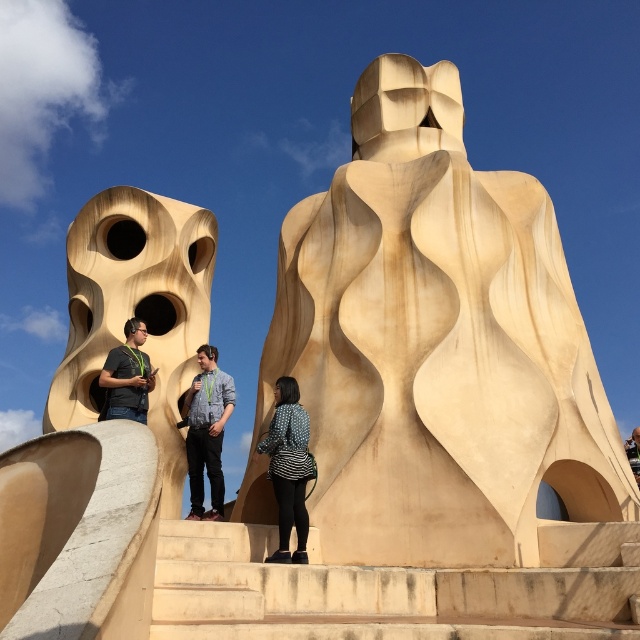
Can you confirm if patterned fabric coat at center is wider than denim shirt at center?

No, patterned fabric coat at center is not wider than denim shirt at center.

Is patterned fabric coat at center taller than denim shirt at center?

No, patterned fabric coat at center is not taller than denim shirt at center.

Locate an element on the screen. This screenshot has height=640, width=640. patterned fabric coat at center is located at coordinates (289, 467).

Between beige smooth sculpture at center and matte black shirt at center, which one appears on the right side from the viewer's perspective?

Positioned to the right is beige smooth sculpture at center.

Is beige smooth sculpture at center positioned behind matte black shirt at center?

No.

Which is behind, point (305, 365) or point (115, 417)?

The point (305, 365) is behind.

Find the location of a particular element. The image size is (640, 640). beige smooth sculpture at center is located at coordinates (436, 344).

Between point (298, 444) and point (99, 419), which one is positioned in front?

Point (298, 444) is in front.

Identify the location of patterned fabric coat at center. The height and width of the screenshot is (640, 640). (289, 467).

Where is `patterned fabric coat at center`? Image resolution: width=640 pixels, height=640 pixels. patterned fabric coat at center is located at coordinates (289, 467).